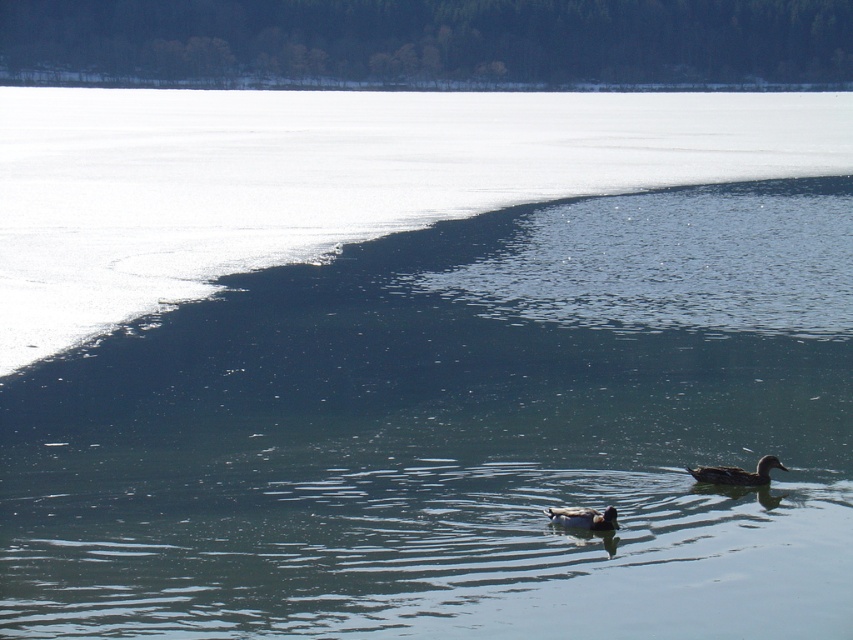
Can you confirm if brown glossy duck at lower right is positioned to the right of brown matte duck at center?

Yes, brown glossy duck at lower right is to the right of brown matte duck at center.

You are a GUI agent. You are given a task and a screenshot of the screen. Output one action in this format:
    pyautogui.click(x=<x>, y=<y>)
    Task: Click on the brown glossy duck at lower right
    
    Given the screenshot: What is the action you would take?
    pyautogui.click(x=737, y=474)